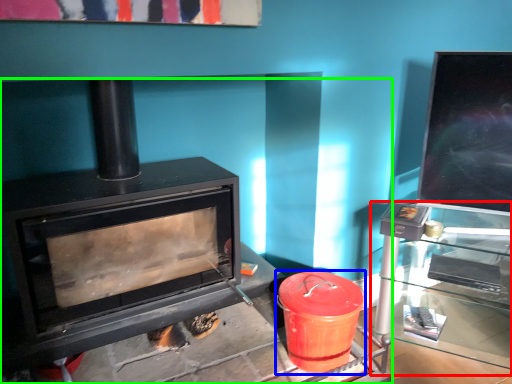
Question: Which object is positioned closest to table (highlighted by a red box)? Select from crock pot (highlighted by a blue box) and wood burning stove (highlighted by a green box).

Choices:
 (A) crock pot
 (B) wood burning stove

Answer: (A)